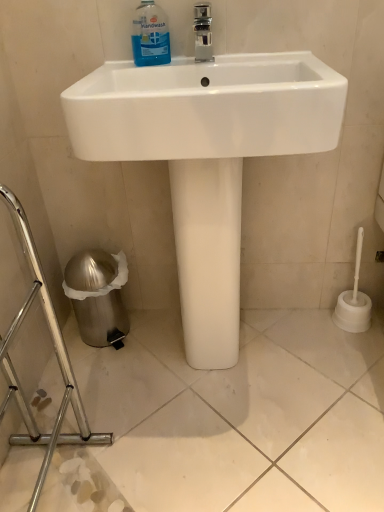
Question: Considering the positions of silver metallic trash can at lower left and blue translucent liquid at upper center in the image, is silver metallic trash can at lower left bigger or smaller than blue translucent liquid at upper center?

Choices:
 (A) big
 (B) small

Answer: (A)

Question: Is silver metallic trash can at lower left spatially inside blue translucent liquid at upper center, or outside of it?

Choices:
 (A) inside
 (B) outside

Answer: (B)

Question: Which object is positioned farthest from the silver metallic trash can at lower left?

Choices:
 (A) blue translucent liquid at upper center
 (B) white glossy sink at center

Answer: (A)

Question: Which is nearer to the silver metallic trash can at lower left?

Choices:
 (A) white glossy sink at center
 (B) blue translucent liquid at upper center

Answer: (A)